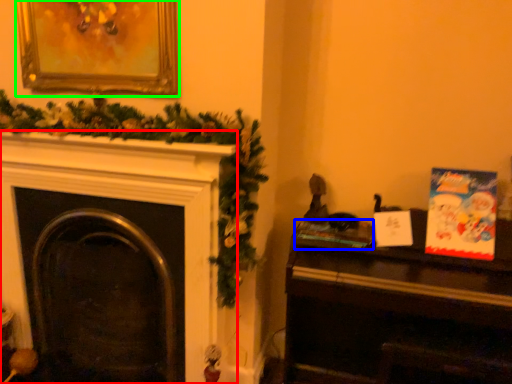
Question: Estimate the real-world distances between objects in this image. Which object is farther from fireplace (highlighted by a red box), book (highlighted by a blue box) or picture frame (highlighted by a green box)?

Choices:
 (A) book
 (B) picture frame

Answer: (A)